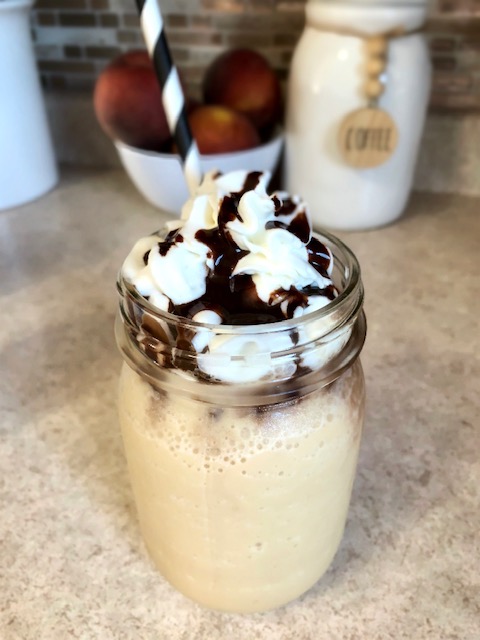
Locate an element on the screen. backsplash is located at coordinates (78, 42), (252, 20), (449, 61).